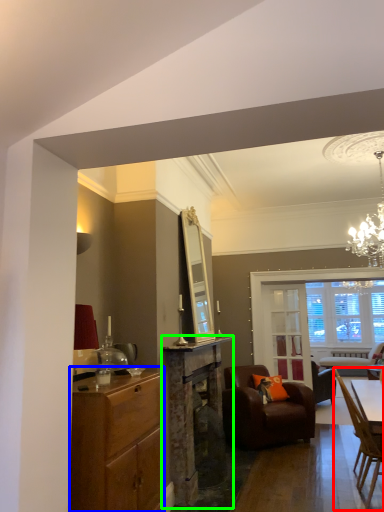
Question: Which object is positioned closest to chair (highlighted by a red box)? Select from cabinetry (highlighted by a blue box) and fireplace (highlighted by a green box).

Choices:
 (A) cabinetry
 (B) fireplace

Answer: (B)